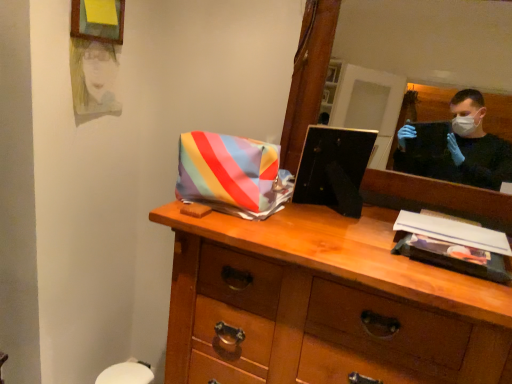
Question: From the image's perspective, is watercolor portrait at upper left positioned above or below wooden mirror at upper right?

Choices:
 (A) above
 (B) below

Answer: (A)

Question: Is watercolor portrait at upper left wider or thinner than wooden mirror at upper right?

Choices:
 (A) thin
 (B) wide

Answer: (A)

Question: Which of these objects is positioned closest to the matte yellow picture frame at upper left?

Choices:
 (A) watercolor portrait at upper left
 (B) wooden chest of drawers at center
 (C) wooden mirror at upper right

Answer: (A)

Question: Which object is positioned closest to the wooden mirror at upper right?

Choices:
 (A) wooden chest of drawers at center
 (B) watercolor portrait at upper left
 (C) matte yellow picture frame at upper left

Answer: (C)